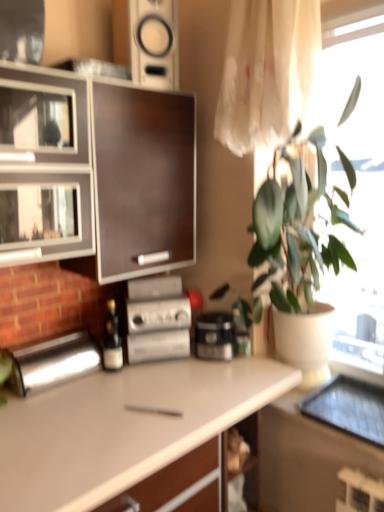
Question: Is polished stainless steel bread bin at left, the 2th appliance positioned from the right, smaller than dark wood cabinet at left?

Choices:
 (A) no
 (B) yes

Answer: (B)

Question: Can we say polished stainless steel bread bin at left, acting as the first appliance starting from the left, lies outside dark wood cabinet at left?

Choices:
 (A) yes
 (B) no

Answer: (A)

Question: Is dark wood cabinet at left at the back of polished stainless steel bread bin at left, the 2th appliance positioned from the right?

Choices:
 (A) yes
 (B) no

Answer: (B)

Question: Can you confirm if polished stainless steel bread bin at left, the 2th appliance positioned from the right, is shorter than dark wood cabinet at left?

Choices:
 (A) yes
 (B) no

Answer: (A)

Question: Is polished stainless steel bread bin at left, the 2th appliance positioned from the right, to the right of dark wood cabinet at left from the viewer's perspective?

Choices:
 (A) no
 (B) yes

Answer: (A)

Question: Considering the relative sizes of polished stainless steel bread bin at left, acting as the first appliance starting from the left, and dark wood cabinet at left in the image provided, is polished stainless steel bread bin at left, acting as the first appliance starting from the left, taller than dark wood cabinet at left?

Choices:
 (A) yes
 (B) no

Answer: (B)

Question: Considering the relative sizes of dark wood cabinet at left and white glossy speaker at upper center in the image provided, is dark wood cabinet at left shorter than white glossy speaker at upper center?

Choices:
 (A) no
 (B) yes

Answer: (A)

Question: Is dark wood cabinet at left not within white glossy speaker at upper center?

Choices:
 (A) yes
 (B) no

Answer: (A)

Question: Can you confirm if dark wood cabinet at left is thinner than white glossy speaker at upper center?

Choices:
 (A) yes
 (B) no

Answer: (B)

Question: Are dark wood cabinet at left and white glossy speaker at upper center making contact?

Choices:
 (A) yes
 (B) no

Answer: (B)

Question: Can you confirm if dark wood cabinet at left is bigger than white glossy speaker at upper center?

Choices:
 (A) no
 (B) yes

Answer: (B)

Question: Is dark wood cabinet at left positioned far away from white glossy speaker at upper center?

Choices:
 (A) no
 (B) yes

Answer: (A)

Question: Considering the relative sizes of wooden shelf at lower center and white matte countertop at center in the image provided, is wooden shelf at lower center smaller than white matte countertop at center?

Choices:
 (A) no
 (B) yes

Answer: (B)